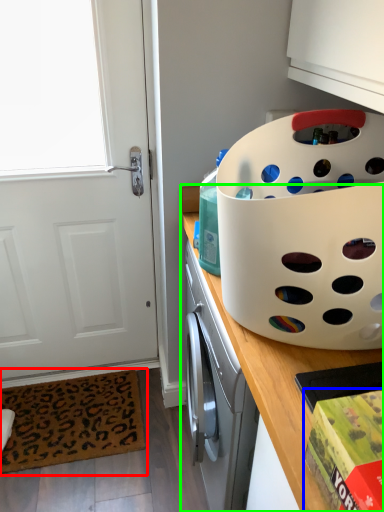
Question: Which object is the closest to the mat (highlighted by a red box)? Choose among these: box (highlighted by a blue box) or countertop (highlighted by a green box).

Choices:
 (A) box
 (B) countertop

Answer: (B)